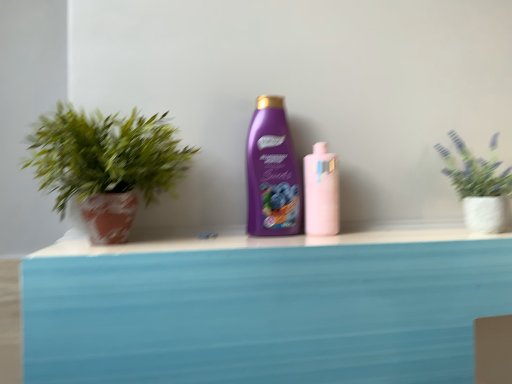
Question: Are pink glossy bottle at center, the 1th bottle when ordered from right to left, and purple glossy shampoo at center, the 2th bottle viewed from the right, far apart?

Choices:
 (A) no
 (B) yes

Answer: (A)

Question: Is pink glossy bottle at center, the 1th bottle when ordered from right to left, positioned before purple glossy shampoo at center, the first bottle in the left-to-right sequence?

Choices:
 (A) no
 (B) yes

Answer: (A)

Question: Does pink glossy bottle at center, the 1th bottle when ordered from right to left, lie behind purple glossy shampoo at center, the first bottle in the left-to-right sequence?

Choices:
 (A) no
 (B) yes

Answer: (B)

Question: Is pink glossy bottle at center, the 1th bottle when ordered from right to left, oriented away from purple glossy shampoo at center, the 2th bottle viewed from the right?

Choices:
 (A) yes
 (B) no

Answer: (B)

Question: From the image's perspective, is pink glossy bottle at center, which appears as the 2th bottle when viewed from the left, below purple glossy shampoo at center, the 2th bottle viewed from the right?

Choices:
 (A) no
 (B) yes

Answer: (B)

Question: Is pink glossy bottle at center, which appears as the 2th bottle when viewed from the left, at the left side of purple glossy shampoo at center, the first bottle in the left-to-right sequence?

Choices:
 (A) yes
 (B) no

Answer: (B)

Question: Is green leafy plant in textured pot at upper right, which is the second houseplant from left to right, behind purple glossy shampoo at center, the 2th bottle viewed from the right?

Choices:
 (A) yes
 (B) no

Answer: (B)

Question: Can you confirm if green leafy plant in textured pot at upper right, which is the second houseplant from left to right, is positioned to the right of purple glossy shampoo at center, the first bottle in the left-to-right sequence?

Choices:
 (A) no
 (B) yes

Answer: (B)

Question: Is green leafy plant in textured pot at upper right, the 1th houseplant viewed from the right, oriented away from purple glossy shampoo at center, the first bottle in the left-to-right sequence?

Choices:
 (A) no
 (B) yes

Answer: (A)

Question: Is green leafy plant in textured pot at upper right, the 1th houseplant viewed from the right, touching purple glossy shampoo at center, the first bottle in the left-to-right sequence?

Choices:
 (A) no
 (B) yes

Answer: (A)

Question: Is the depth of green leafy plant in textured pot at upper right, the 1th houseplant viewed from the right, less than that of purple glossy shampoo at center, the first bottle in the left-to-right sequence?

Choices:
 (A) no
 (B) yes

Answer: (B)

Question: From the image's perspective, is green leafy plant in textured pot at upper right, which is the second houseplant from left to right, on top of purple glossy shampoo at center, the first bottle in the left-to-right sequence?

Choices:
 (A) yes
 (B) no

Answer: (B)

Question: From a real-world perspective, is green leafy plant in textured pot at upper right, which is the second houseplant from left to right, positioned under green matte plant at left, the 1th houseplant viewed from the left, based on gravity?

Choices:
 (A) yes
 (B) no

Answer: (A)